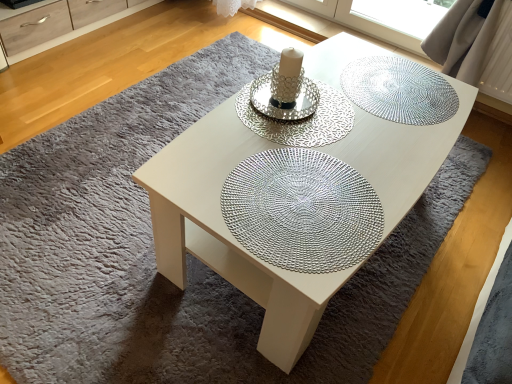
The image size is (512, 384). Find the location of `free region on the left part of silver textured doily at center, the first glass plate in the front-to-back sequence`. free region on the left part of silver textured doily at center, the first glass plate in the front-to-back sequence is located at coordinates (198, 165).